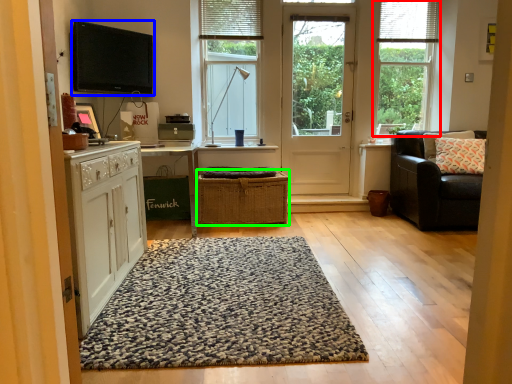
Question: Which object is the closest to the window (highlighted by a red box)? Choose among these: electronic (highlighted by a blue box) or crate (highlighted by a green box).

Choices:
 (A) electronic
 (B) crate

Answer: (B)